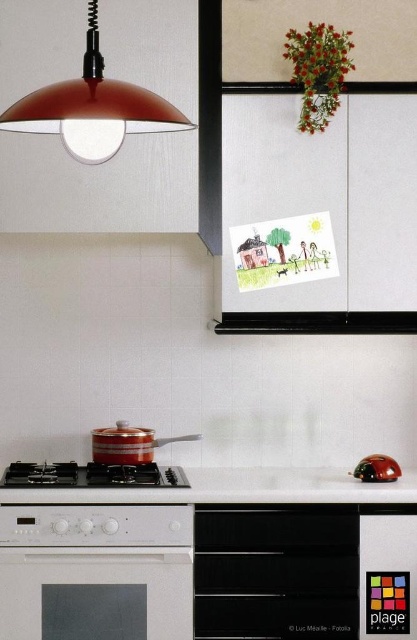
Question: Based on their relative distances, which object is nearer to the black matte gas stove at lower center?

Choices:
 (A) white glossy countertop at lower center
 (B) black matte exhaust hood at center
 (C) matte red lampshade at upper left

Answer: (A)

Question: Can you confirm if white glossy oven at lower left is positioned to the right of black matte exhaust hood at center?

Choices:
 (A) no
 (B) yes

Answer: (A)

Question: Can you confirm if white glossy countertop at lower center is positioned below metallic red ladybug at lower right?

Choices:
 (A) no
 (B) yes

Answer: (B)

Question: Which object is positioned closest to the black matte oven at lower center?

Choices:
 (A) metallic red ladybug at lower right
 (B) black matte gas stove at lower center

Answer: (A)

Question: Which object appears closest to the camera in this image?

Choices:
 (A) matte red lampshade at upper left
 (B) black matte exhaust hood at center

Answer: (A)

Question: In this image, where is white glossy oven at lower left located relative to matte red lampshade at upper left?

Choices:
 (A) above
 (B) below

Answer: (B)